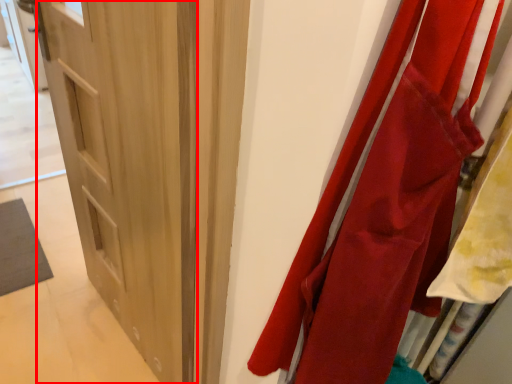
Question: From the image's perspective, what is the correct spatial positioning of door (annotated by the red box) in reference to curtain?

Choices:
 (A) below
 (B) above

Answer: (B)